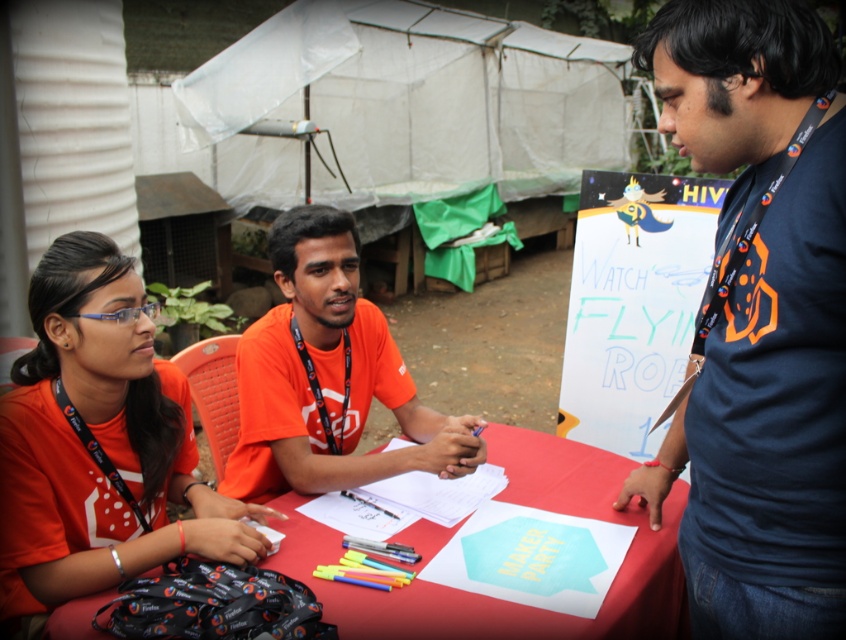
Question: Which of the following is the farthest from the observer?

Choices:
 (A) red fabric tablecloth at center
 (B) orange fabric shirt at center
 (C) dark blue t-shirt at right
 (D) matte orange shirt at left

Answer: (B)

Question: Can you confirm if dark blue t-shirt at right is positioned to the left of matte orange shirt at left?

Choices:
 (A) yes
 (B) no

Answer: (B)

Question: Among these objects, which one is nearest to the camera?

Choices:
 (A) dark blue t-shirt at right
 (B) orange fabric shirt at center
 (C) matte orange shirt at left
 (D) red fabric tablecloth at center

Answer: (A)

Question: Is orange fabric shirt at center smaller than red fabric tablecloth at center?

Choices:
 (A) yes
 (B) no

Answer: (A)

Question: Which point is closer to the camera?

Choices:
 (A) matte orange shirt at left
 (B) red fabric tablecloth at center

Answer: (B)

Question: Observing the image, what is the correct spatial positioning of orange fabric shirt at center in reference to red fabric tablecloth at center?

Choices:
 (A) below
 (B) above

Answer: (B)